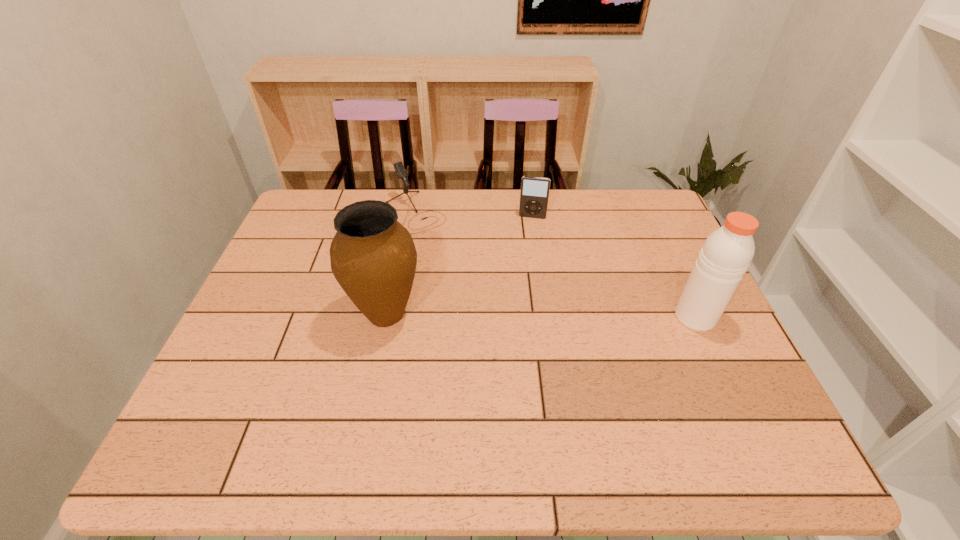
You are a GUI agent. You are given a task and a screenshot of the screen. Output one action in this format:
    pyautogui.click(x=<x>, y=<y>)
    Task: Click on the urn
    Image resolution: width=960 pixels, height=540 pixels.
    Given the screenshot: What is the action you would take?
    pyautogui.click(x=373, y=257)

What are the coordinates of `shaker` in the screenshot? It's located at tap(726, 254).

Where is `the second object from right to left`? the second object from right to left is located at coordinates (534, 194).

The width and height of the screenshot is (960, 540). What are the coordinates of `microphone` in the screenshot? It's located at 401,172.

Image resolution: width=960 pixels, height=540 pixels. Identify the location of free space located on the back of the urn. (408, 207).

Locate an element on the screen. free space located 0.090m on the back of the shaker is located at coordinates (677, 278).

At what (x,y) coordinates should I click in order to perform the action: click on free location located on the front-facing side of the iPod. Please return your answer as a coordinate pair (x, y). This screenshot has width=960, height=540. Looking at the image, I should click on (521, 278).

Identify the location of vacant space located on the front-facing side of the iPod. (527, 239).

Locate an element on the screen. vacant area situated 0.170m on the front-facing side of the iPod is located at coordinates (x=525, y=254).

Image resolution: width=960 pixels, height=540 pixels. What are the coordinates of `blank space located 0.210m on the stand of the microphone` in the screenshot? It's located at (466, 269).